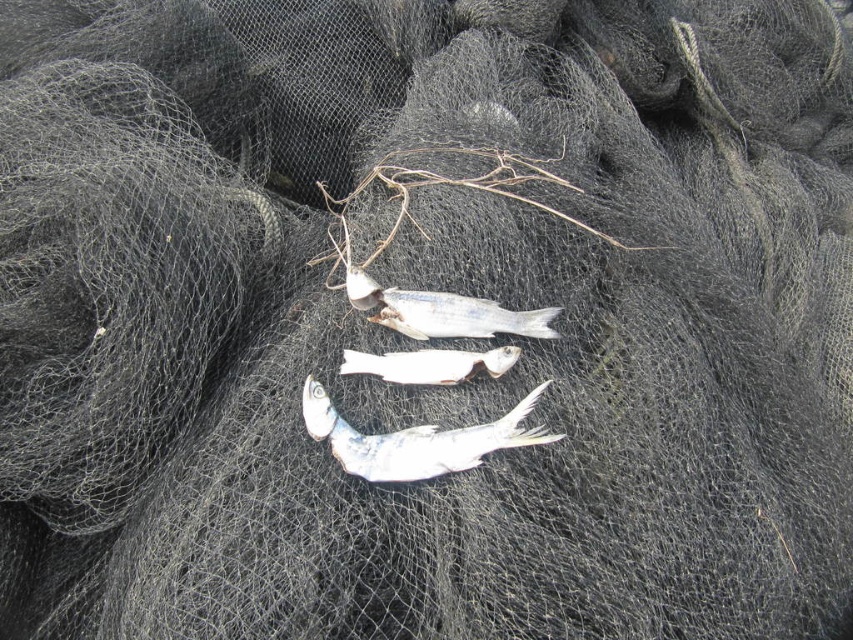
You are an observer looking at the fishing net. You see two types of fish, the white matte fish at center and the white glossy fish at center. Which fish is closer to you?

The white matte fish at center is closer to you because the white glossy fish at center is behind it.

You are an angler who just caught two fish, a white matte fish at center and a white glossy fish at center. You want to display them on a vertical display board so that the taller fish is at the top. Which fish should you place higher?

The white matte fish at center has a greater height compared to the white glossy fish at center, so you should place the white matte fish at center higher on the display board.